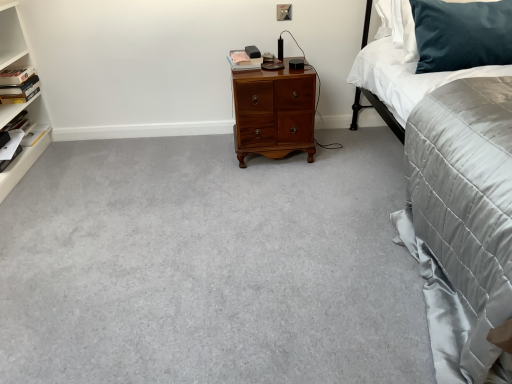
This screenshot has width=512, height=384. What do you see at coordinates (459, 213) in the screenshot?
I see `satin grey quilt at right` at bounding box center [459, 213].

What do you see at coordinates (405, 77) in the screenshot? This screenshot has height=384, width=512. I see `white satin sheet at upper right` at bounding box center [405, 77].

Measure the distance between point (506,49) and camera.

The depth of point (506,49) is 5.47 feet.

Find the location of `matte pink book at center, which is counted as the 1th book, starting from the top`. matte pink book at center, which is counted as the 1th book, starting from the top is located at coordinates click(243, 61).

Locate an element on the screen. Image resolution: width=512 pixels, height=384 pixels. satin grey quilt at right is located at coordinates (459, 213).

Is hardcover book at left, the 2th book from the bottom, not within satin grey quilt at right?

Indeed, hardcover book at left, the 2th book from the bottom, is completely outside satin grey quilt at right.

Is satin grey quilt at right at the back of hardcover book at left, marked as the 2th book in a top-to-bottom arrangement?

hardcover book at left, marked as the 2th book in a top-to-bottom arrangement, is not turned away from satin grey quilt at right.

Is hardcover book at left, marked as the 2th book in a top-to-bottom arrangement, touching satin grey quilt at right?

No, hardcover book at left, marked as the 2th book in a top-to-bottom arrangement, is not next to satin grey quilt at right.

From a real-world perspective, between satin grey quilt at right and white satin sheet at upper right, who is vertically higher?

white satin sheet at upper right.

Is satin grey quilt at right turned away from white satin sheet at upper right?

Yes, satin grey quilt at right is positioned with its back facing white satin sheet at upper right.

Which is behind, point (457, 220) or point (446, 79)?

The point (446, 79) is farther.

Are satin grey quilt at right and white satin sheet at upper right beside each other?

No, satin grey quilt at right is not with white satin sheet at upper right.

Do you think white paper at left, the 2th book in the right-to-left sequence, is within matte pink book at center, which ranks as the first book in right-to-left order, or outside of it?

white paper at left, the 2th book in the right-to-left sequence, is outside matte pink book at center, which ranks as the first book in right-to-left order.

Visually, is white paper at left, marked as the 3th book in a top-to-bottom arrangement, positioned to the left or to the right of matte pink book at center, placed as the third book when sorted from bottom to top?

Based on their positions, white paper at left, marked as the 3th book in a top-to-bottom arrangement, is located to the left of matte pink book at center, placed as the third book when sorted from bottom to top.

How different are the orientations of white paper at left, which is the second book from left to right, and matte pink book at center, which ranks as the first book in right-to-left order, in degrees?

They differ by 81.9 degrees in their facing directions.

Is point (23, 124) more distant than point (238, 55)?

Yes.

What's the angular difference between shiny brown wooden nightstand at center and matte pink book at center, which is counted as the 1th book, starting from the top,'s facing directions?

5.8 degrees.

Is shiny brown wooden nightstand at center positioned with its back to matte pink book at center, marked as the 3th book in a left-to-right arrangement?

No, shiny brown wooden nightstand at center is not facing the opposite direction of matte pink book at center, marked as the 3th book in a left-to-right arrangement.

From the image's perspective, between shiny brown wooden nightstand at center and matte pink book at center, placed as the third book when sorted from bottom to top, which one is located above?

matte pink book at center, placed as the third book when sorted from bottom to top, from the image's perspective.

Considering their positions, is gray carpet at center located in front of or behind dark blue velvet pillow at upper right?

Clearly, gray carpet at center is in front of dark blue velvet pillow at upper right.

Considering the sizes of objects gray carpet at center and dark blue velvet pillow at upper right in the image provided, who is taller, gray carpet at center or dark blue velvet pillow at upper right?

dark blue velvet pillow at upper right is taller.

Consider the image. From the image's perspective, is gray carpet at center located beneath dark blue velvet pillow at upper right?

Yes, from the image's perspective, gray carpet at center is below dark blue velvet pillow at upper right.

Which of these two, gray carpet at center or dark blue velvet pillow at upper right, is bigger?

gray carpet at center is bigger.

Is matte pink book at center, which is counted as the 1th book, starting from the top, turned away from gray carpet at center?

No, gray carpet at center is not at the back of matte pink book at center, which is counted as the 1th book, starting from the top.

Where is `plain below the matte pink book at center, marked as the 3th book in a left-to-right arrangement (from a real-world perspective)`? Image resolution: width=512 pixels, height=384 pixels. plain below the matte pink book at center, marked as the 3th book in a left-to-right arrangement (from a real-world perspective) is located at coordinates (210, 266).

Could you measure the distance between matte pink book at center, marked as the 3th book in a left-to-right arrangement, and gray carpet at center?

The distance of matte pink book at center, marked as the 3th book in a left-to-right arrangement, from gray carpet at center is 1.02 meters.

Is matte pink book at center, marked as the 3th book in a left-to-right arrangement, far from gray carpet at center?

Absolutely, matte pink book at center, marked as the 3th book in a left-to-right arrangement, is distant from gray carpet at center.

Is shiny brown wooden nightstand at center thinner than white satin sheet at upper right?

Yes.

Which object is positioned more to the left, shiny brown wooden nightstand at center or white satin sheet at upper right?

shiny brown wooden nightstand at center is more to the left.

Looking at the image, does shiny brown wooden nightstand at center seem bigger or smaller compared to white satin sheet at upper right?

In the image, shiny brown wooden nightstand at center appears to be smaller than white satin sheet at upper right.

You are a GUI agent. You are given a task and a screenshot of the screen. Output one action in this format:
    pyautogui.click(x=<x>, y=<y>)
    Task: Click on the bed below the hardcover book at left, marked as the 2th book in a top-to-bottom arrangement (from the image's perspective)
    
    Given the screenshot: What is the action you would take?
    pyautogui.click(x=459, y=213)

The height and width of the screenshot is (384, 512). I want to click on sheet that is behind the satin grey quilt at right, so click(x=405, y=77).

Estimate the real-world distances between objects in this image. Which object is closer to shiny brown wooden nightstand at center, white paper at left, which is the second book from left to right, or white satin sheet at upper right?

white satin sheet at upper right.

Based on their spatial positions, is matte pink book at center, marked as the 3th book in a left-to-right arrangement, or shiny brown wooden nightstand at center closer to white paper at left, the 2th book in the right-to-left sequence?

The object closer to white paper at left, the 2th book in the right-to-left sequence, is matte pink book at center, marked as the 3th book in a left-to-right arrangement.

When comparing their distances from shiny brown wooden nightstand at center, does hardcover book at left, the 2th book from the bottom, or matte pink book at center, placed as the third book when sorted from bottom to top, seem closer?

Based on the image, matte pink book at center, placed as the third book when sorted from bottom to top, appears to be nearer to shiny brown wooden nightstand at center.

When comparing their distances from white paper at left, arranged as the first book when ordered from the bottom, does white satin sheet at upper right or gray carpet at center seem further?

Based on the image, white satin sheet at upper right appears to be further to white paper at left, arranged as the first book when ordered from the bottom.

Which object lies nearer to the anchor point matte pink book at center, marked as the 3th book in a left-to-right arrangement, shiny brown wooden nightstand at center or white paper at left, marked as the 3th book in a top-to-bottom arrangement?

Among the two, shiny brown wooden nightstand at center is located nearer to matte pink book at center, marked as the 3th book in a left-to-right arrangement.

Which object lies nearer to the anchor point matte pink book at center, placed as the third book when sorted from bottom to top, gray carpet at center or white paper at left, arranged as the first book when ordered from the bottom?

gray carpet at center is positioned closer to the anchor matte pink book at center, placed as the third book when sorted from bottom to top.

From the image, which object appears to be farther from hardcover book at left, the third book when ordered from right to left, matte pink book at center, marked as the 3th book in a left-to-right arrangement, or gray carpet at center?

gray carpet at center.

From the image, which object appears to be nearer to dark blue velvet pillow at upper right, gray carpet at center or white paper at left, marked as the 3th book in a top-to-bottom arrangement?

gray carpet at center is positioned closer to the anchor dark blue velvet pillow at upper right.

The width and height of the screenshot is (512, 384). Find the location of `book located between gray carpet at center and white satin sheet at upper right in the left-right direction`. book located between gray carpet at center and white satin sheet at upper right in the left-right direction is located at coordinates (243, 61).

What are the coordinates of `pillow situated between gray carpet at center and white satin sheet at upper right from left to right` in the screenshot? It's located at (462, 34).

Find the location of `book between hardcover book at left, marked as the 2th book in a top-to-bottom arrangement, and matte pink book at center, placed as the third book when sorted from bottom to top`. book between hardcover book at left, marked as the 2th book in a top-to-bottom arrangement, and matte pink book at center, placed as the third book when sorted from bottom to top is located at coordinates (14, 128).

Image resolution: width=512 pixels, height=384 pixels. Find the location of `plain situated between hardcover book at left, the 2th book from the bottom, and shiny brown wooden nightstand at center from left to right`. plain situated between hardcover book at left, the 2th book from the bottom, and shiny brown wooden nightstand at center from left to right is located at coordinates (210, 266).